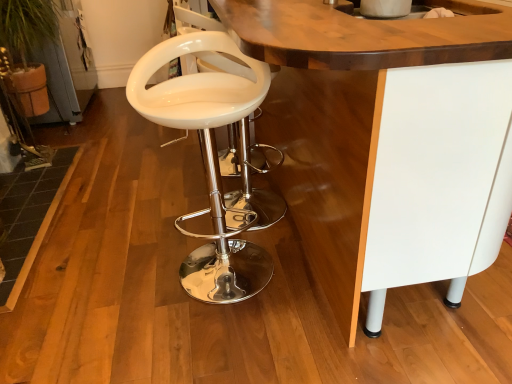
Identify the location of vacant area that is situated to the right of white glossy bar stool at center. This screenshot has height=384, width=512. (298, 269).